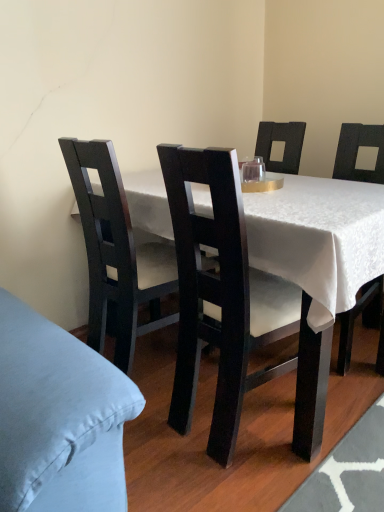
Identify the location of free spot in front of matte black chair at center, marked as the second chair in a left-to-right arrangement. The width and height of the screenshot is (384, 512). (242, 488).